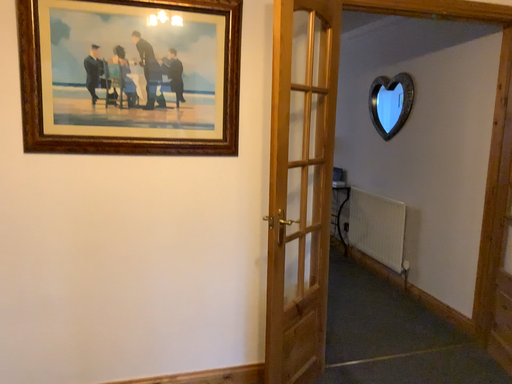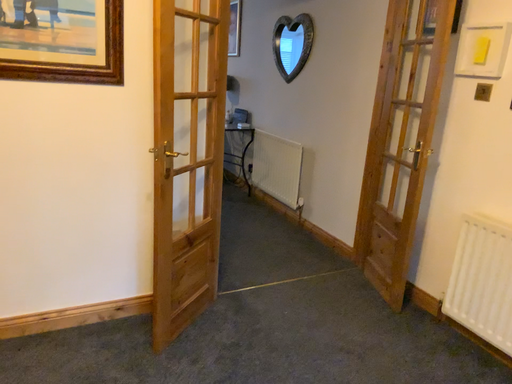
Question: How did the camera likely rotate when shooting the video?

Choices:
 (A) rotated upward
 (B) rotated downward

Answer: (B)